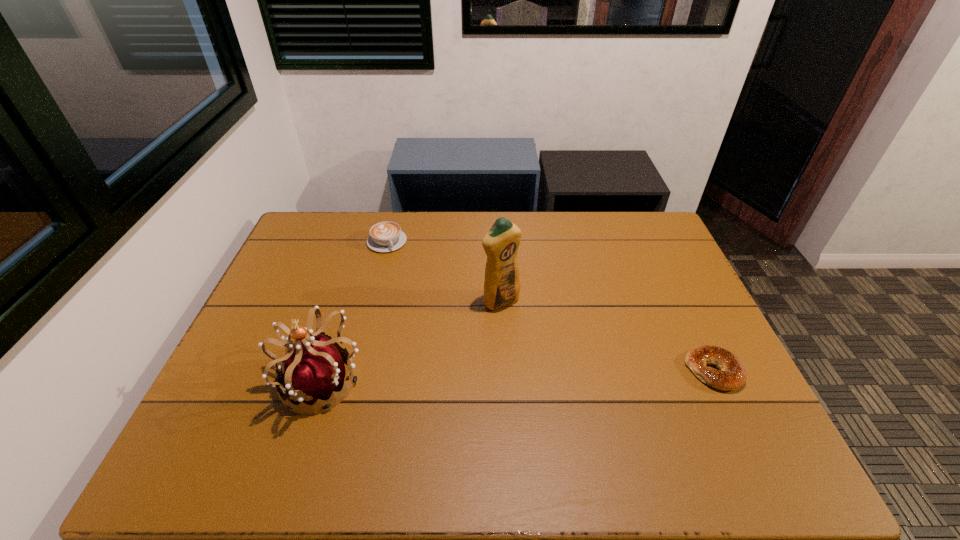
The image size is (960, 540). In order to click on free spot located on the label of the second farthest object in this screenshot , I will do `click(549, 346)`.

I want to click on free spot located 0.200m on the label of the second farthest object, so point(560,355).

I want to click on blank area located on the label of the second farthest object, so click(612, 404).

Locate an element on the screen. The image size is (960, 540). free spot located on the side of the third tallest object with the handle is located at coordinates (418, 298).

The height and width of the screenshot is (540, 960). Identify the location of vacant area situated on the side of the third tallest object with the handle. (430, 319).

Where is `blank area located 0.290m on the side of the third tallest object with the handle`? The width and height of the screenshot is (960, 540). blank area located 0.290m on the side of the third tallest object with the handle is located at coordinates (424, 308).

Find the location of a particular element. Image resolution: width=960 pixels, height=540 pixels. object at the far edge is located at coordinates (387, 236).

Where is `object present at the near edge`? Image resolution: width=960 pixels, height=540 pixels. object present at the near edge is located at coordinates (314, 370).

You are a GUI agent. You are given a task and a screenshot of the screen. Output one action in this format:
    pyautogui.click(x=<x>, y=<y>)
    Task: Click on the object positioned at the left edge
    
    Given the screenshot: What is the action you would take?
    pyautogui.click(x=314, y=370)

You are a GUI agent. You are given a task and a screenshot of the screen. Output one action in this format:
    pyautogui.click(x=<x>, y=<y>)
    Task: Click on the object that is positioned at the right edge
    
    Given the screenshot: What is the action you would take?
    pyautogui.click(x=731, y=375)